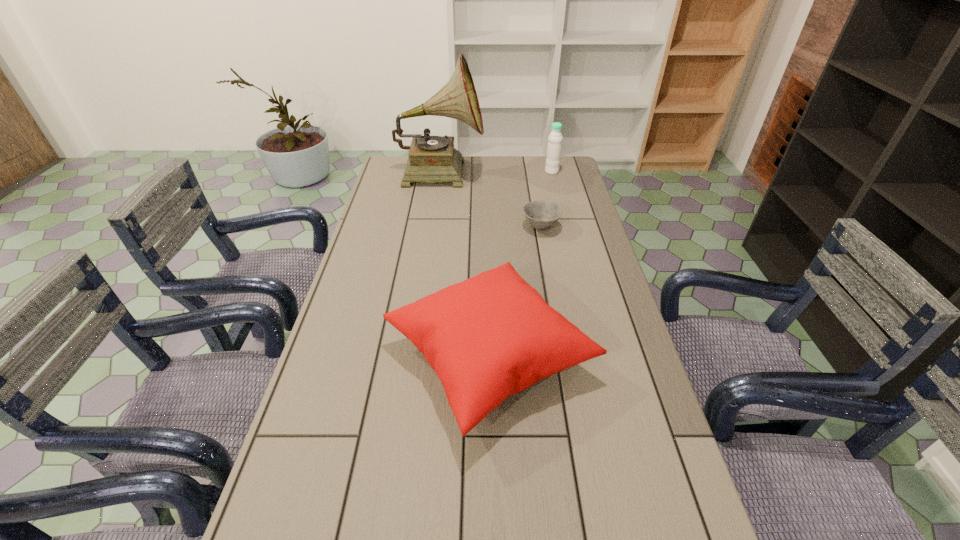
In order to click on record player that is at the far edge in this screenshot , I will do `click(431, 159)`.

What are the coordinates of `water bottle situated at the far edge` in the screenshot? It's located at (554, 147).

Where is `record player positioned at the left edge`? The image size is (960, 540). record player positioned at the left edge is located at coordinates (431, 159).

The width and height of the screenshot is (960, 540). Find the location of `cushion located at the left edge`. cushion located at the left edge is located at coordinates pyautogui.click(x=488, y=337).

You are a GUI agent. You are given a task and a screenshot of the screen. Output one action in this format:
    pyautogui.click(x=<x>, y=<y>)
    Task: Click on the water bottle that is positioned at the right edge
    The height and width of the screenshot is (540, 960).
    Given the screenshot: What is the action you would take?
    pyautogui.click(x=554, y=147)

Identify the location of cushion positioned at the right edge. (488, 337).

Find the location of a particular element. The width and height of the screenshot is (960, 540). bowl that is at the right edge is located at coordinates (541, 215).

Locate an element on the screen. This screenshot has height=540, width=960. object that is positioned at the far left corner is located at coordinates (431, 159).

Find the location of a particular element. This screenshot has height=540, width=960. object at the far right corner is located at coordinates (554, 147).

The image size is (960, 540). What are the coordinates of `free point at the left edge` in the screenshot? It's located at (378, 254).